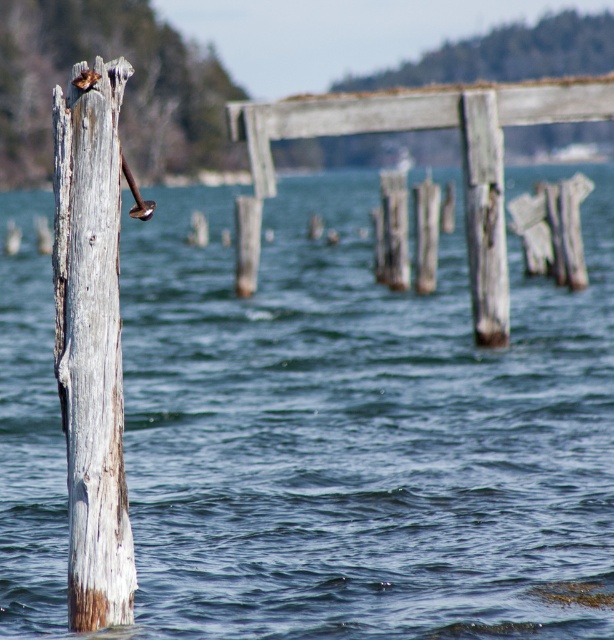
You are a photographer standing at the waterfront scene. You want to capture a photo where the gray weathered wood post at left is visible below the clear blue water at center. Is this possible based on the scene?

Yes, the clear blue water at center is above the gray weathered wood post at left, so the post will naturally appear below the water in the photo.

You are a photographer standing at the edge of the water, aiming to capture the gray weathered wood post at left in your shot. Your camera has a minimum focusing distance of 25 feet. Will you need to move closer or farther away to ensure the post is in focus?

The gray weathered wood post at left is 20.56 feet away from the camera. Since your camera requires a minimum focusing distance of 25 feet, you need to move farther away from the post to ensure it is in focus.